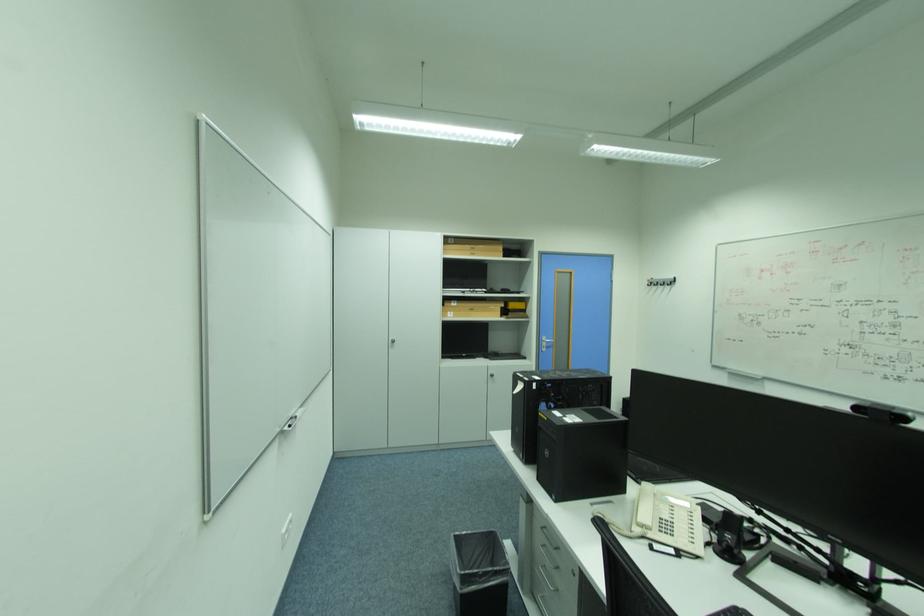
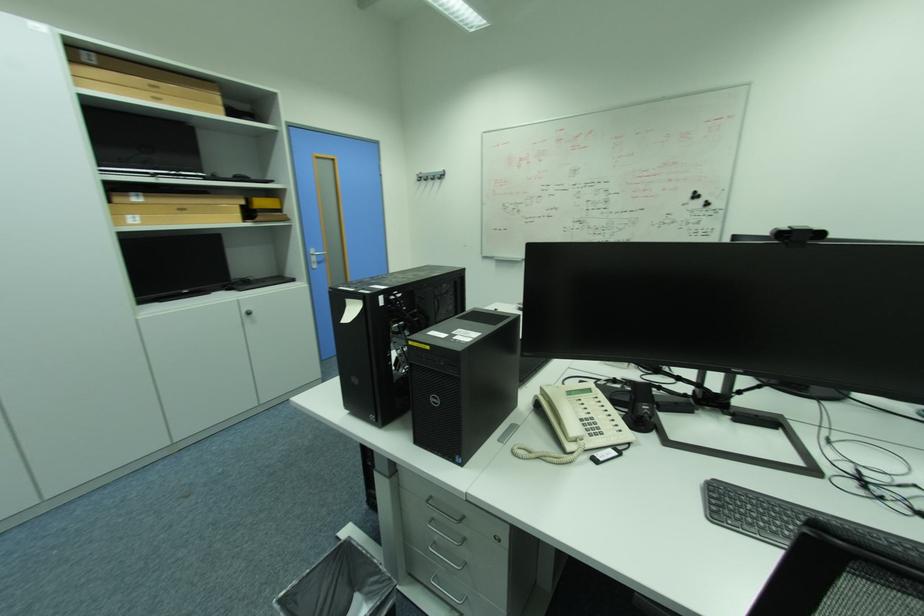
In the second image, find the point that corresponds to (x=456, y=313) in the first image.

(136, 217)